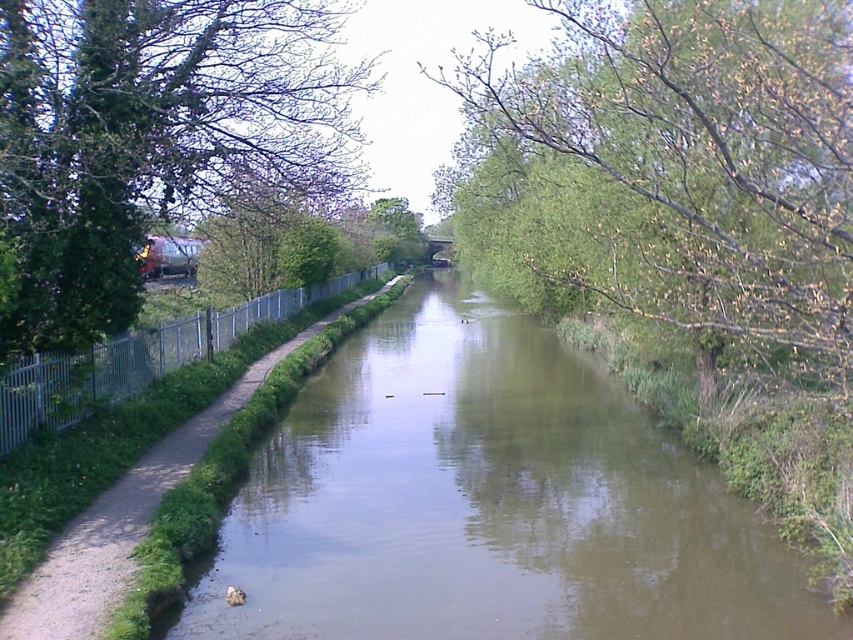
Based on the photo, you are standing on the paved path next to the canal and want to take a photo of the green leafy tree at left. Given its position at coordinates approximately 0.217 on the x and 0.181 on the y axis, which direction should you face to capture it in your camera view?

The green leafy tree at left is located at coordinates approximately 0.217 on the x and 0.181 on the y axis. Since the tree is at the left side of the scene, you should face towards the left direction to capture it in your camera view.

You are a landscape photographer planning to capture the canal scene. You want to ensure both the green smooth water at center and the green leafy tree at center are visible in your shot. Based on their sizes, which object should you focus on to ensure both fit in the frame?

The green smooth water at center occupies less space than the green leafy tree at center, so focusing on the larger green leafy tree at center would help ensure both fit in the frame.